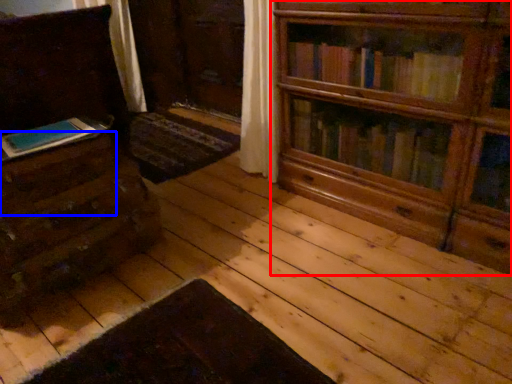
Question: Which point is closer to the camera, bookcase (highlighted by a red box) or drawer (highlighted by a blue box)?

Choices:
 (A) bookcase
 (B) drawer

Answer: (A)